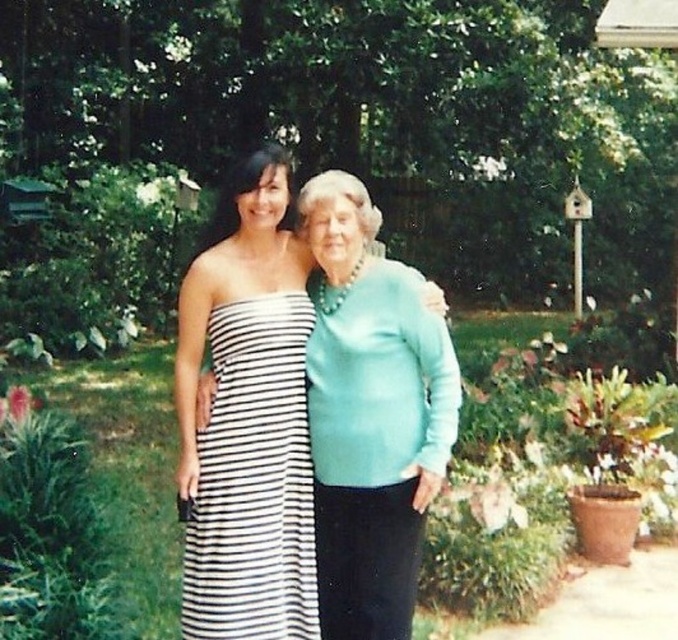
You are designing a new clothing line and want to create a matching outfit using both the teal satin blouse at center and the black and white striped dress at center. Which garment should you choose as the base for the outfit to ensure proper proportion and balance?

The teal satin blouse at center has a larger width than the black and white striped dress at center, so it should be chosen as the base for the outfit to ensure proper proportion and balance.

You are a photographer trying to capture a clear shot of the teal satin blouse at center and the black and white striped dress at center. Based on their positions, which one is closer to the camera?

The teal satin blouse at center is in front of the black and white striped dress at center, so it is closer to the camera.

You are a photographer trying to capture a portrait of both the teal satin blouse at center and the black and white striped dress at center. Since you want to include both subjects in the frame, which direction should you position yourself relative to the models to ensure both are fully visible?

You should position yourself to the left of the models because the teal satin blouse at center is to the right of the black and white striped dress at center. This way, both subjects will be fully visible in the frame without any overlap.